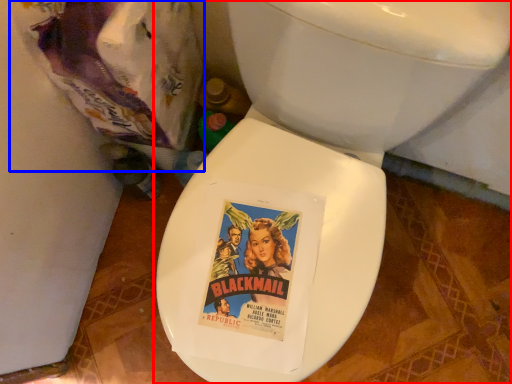
Question: Which point is closer to the camera, toilet (highlighted by a red box) or garbage (highlighted by a blue box)?

Choices:
 (A) toilet
 (B) garbage

Answer: (A)